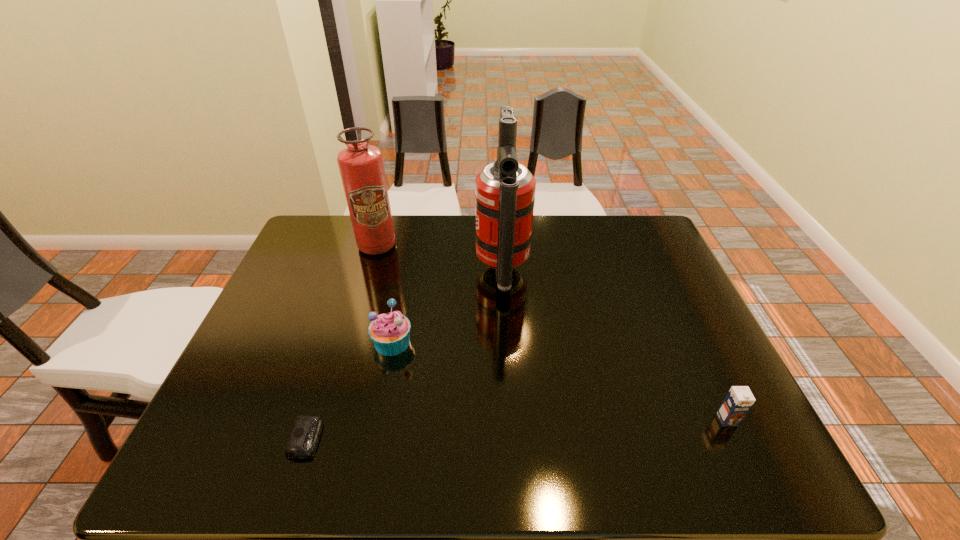
Find the location of a particular element. empty space between the left fire extinguisher and the rightmost object is located at coordinates click(x=552, y=333).

The width and height of the screenshot is (960, 540). I want to click on vacant area between the taller fire extinguisher and the rightmost object, so click(x=614, y=346).

The height and width of the screenshot is (540, 960). I want to click on vacant region between the muffin and the rightmost object, so click(x=560, y=381).

In order to click on vacant area that lies between the alarm clock and the third farthest object in this screenshot , I will do `click(349, 390)`.

At what (x,y) coordinates should I click in order to perform the action: click on free space between the second tallest object and the rightmost object. Please return your answer as a coordinate pair (x, y). The height and width of the screenshot is (540, 960). Looking at the image, I should click on (552, 333).

Identify the location of vacant space that's between the second tallest object and the rightmost object. The height and width of the screenshot is (540, 960). (552, 333).

Where is `free area in between the alarm clock and the muffin`? The image size is (960, 540). free area in between the alarm clock and the muffin is located at coordinates (349, 390).

Locate an element on the screen. This screenshot has width=960, height=540. free space between the tallest object and the rightmost object is located at coordinates (614, 346).

The height and width of the screenshot is (540, 960). In order to click on empty space between the shorter fire extinguisher and the rightmost object in this screenshot , I will do `click(552, 333)`.

This screenshot has height=540, width=960. Identify the location of free area in between the chocolate milk and the second tallest object. (552, 333).